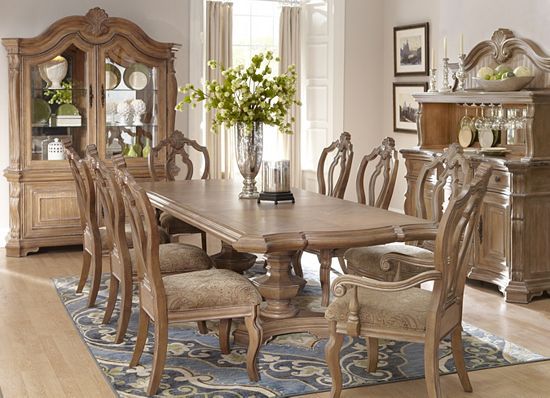
Locate an element on the screen. This screenshot has height=398, width=550. chairs is located at coordinates (415, 290), (414, 253), (382, 192), (351, 175), (185, 154), (89, 227), (122, 263), (210, 298).